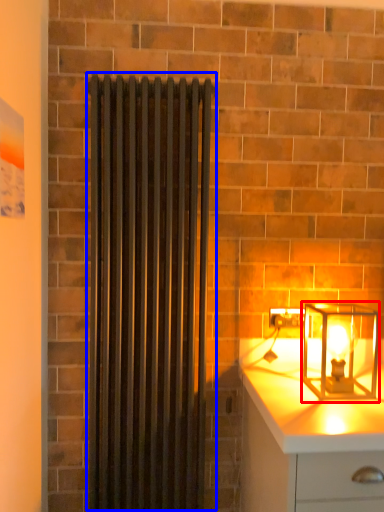
Question: Which object is closer to the camera taking this photo, lamp (highlighted by a red box) or shower curtain (highlighted by a blue box)?

Choices:
 (A) lamp
 (B) shower curtain

Answer: (A)